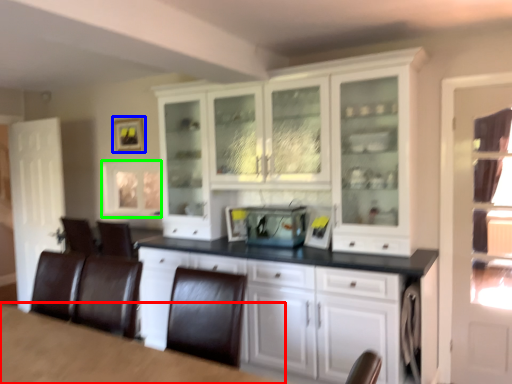
Question: Considering the real-world distances, which object is closest to table (highlighted by a red box)? picture frame (highlighted by a blue box) or window (highlighted by a green box).

Choices:
 (A) picture frame
 (B) window

Answer: (B)